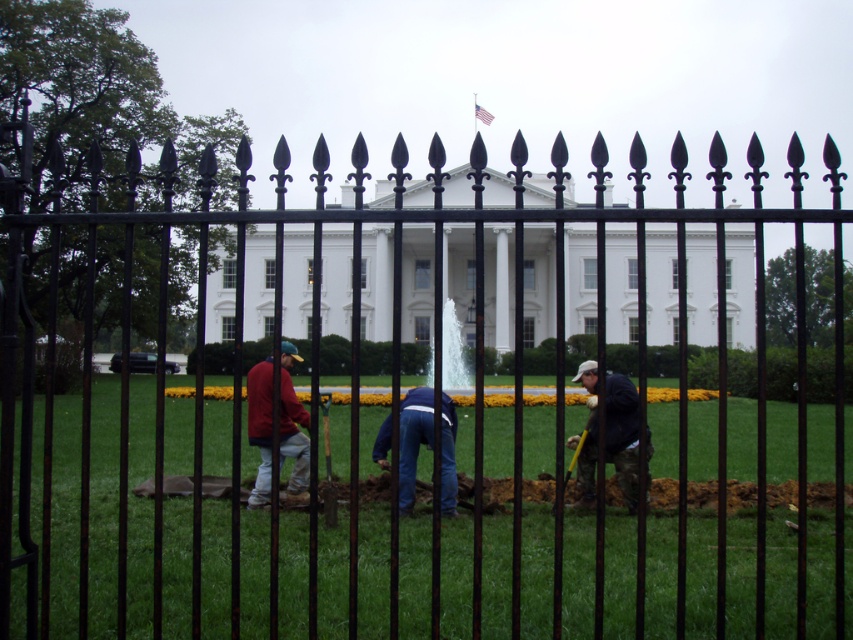
Is matte red shirt at center smaller than yellow plastic shovel at center?

Actually, matte red shirt at center might be larger than yellow plastic shovel at center.

Does matte red shirt at center have a greater width compared to yellow plastic shovel at center?

Yes, matte red shirt at center is wider than yellow plastic shovel at center.

Does point (294, 426) lie behind point (334, 497)?

Yes, it is.

You are a GUI agent. You are given a task and a screenshot of the screen. Output one action in this format:
    pyautogui.click(x=<x>, y=<y>)
    Task: Click on the matte red shirt at center
    
    Given the screenshot: What is the action you would take?
    pyautogui.click(x=292, y=422)

Does camouflage pants at center have a lesser height compared to matte red shirt at center?

Yes.

Can you confirm if camouflage pants at center is smaller than matte red shirt at center?

Indeed, camouflage pants at center has a smaller size compared to matte red shirt at center.

Does point (628, 490) lie in front of point (250, 387)?

No, it is behind (250, 387).

At what (x,y) coordinates should I click in order to perform the action: click on camouflage pants at center. Please return your answer as a coordinate pair (x, y). Looking at the image, I should click on (622, 435).

Who is higher up, blue jeans at center or yellow plastic shovel at center?

blue jeans at center

Does blue jeans at center have a greater height compared to yellow plastic shovel at center?

Incorrect, blue jeans at center's height is not larger of yellow plastic shovel at center's.

Which is behind, point (398, 502) or point (335, 488)?

The point (335, 488) is behind.

Locate an element on the screen. blue jeans at center is located at coordinates (413, 440).